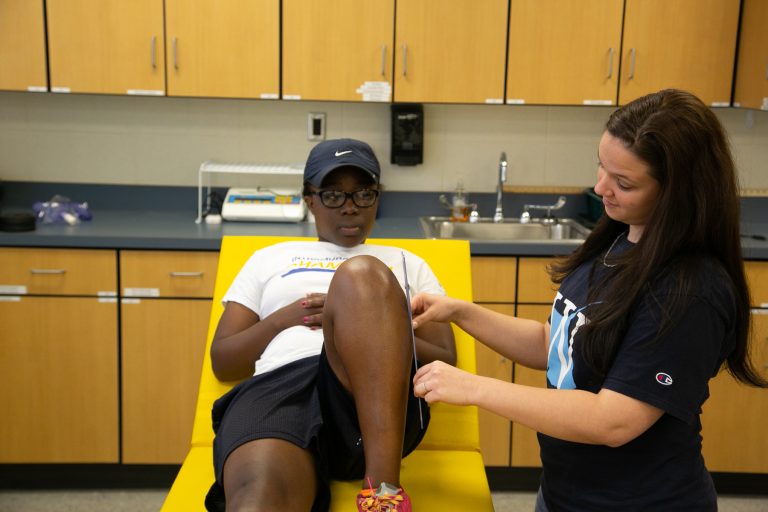
This screenshot has width=768, height=512. In order to click on soap dispenser in this screenshot , I will do `click(405, 143)`.